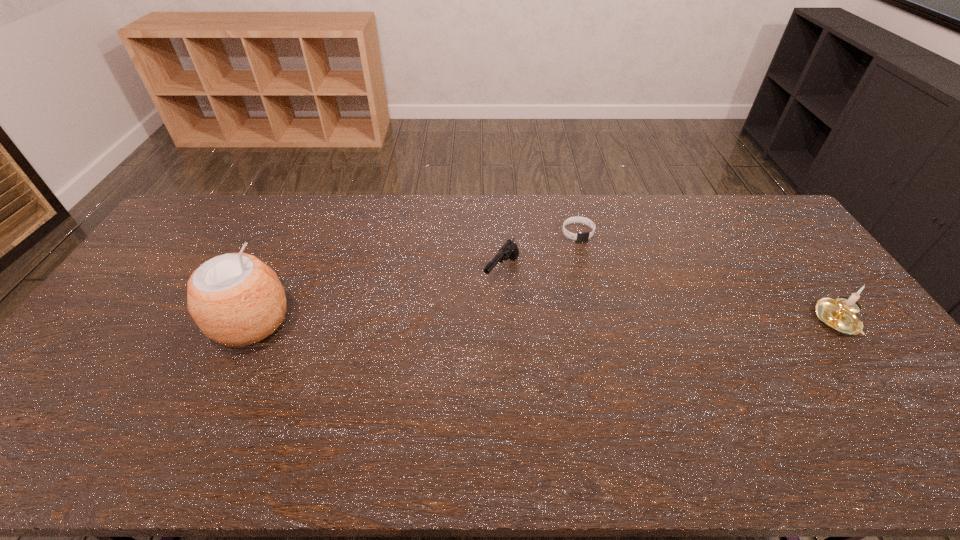
The image size is (960, 540). In order to click on vacant region located on the outer surface of the second object from right to left in this screenshot , I will do [x=615, y=308].

You are a GUI agent. You are given a task and a screenshot of the screen. Output one action in this format:
    pyautogui.click(x=<x>, y=<y>)
    Task: Click on the vacant space located 0.340m on the outer surface of the second object from right to left
    
    Given the screenshot: What is the action you would take?
    pyautogui.click(x=620, y=319)

You are a GUI agent. You are given a task and a screenshot of the screen. Output one action in this format:
    pyautogui.click(x=<x>, y=<y>)
    Task: Click on the vacant position located on the outer surface of the second object from right to left
    The height and width of the screenshot is (540, 960).
    Given the screenshot: What is the action you would take?
    pyautogui.click(x=592, y=262)

Where is `vacant space positioned at the end of the barrel of the second object from left to right`? The height and width of the screenshot is (540, 960). vacant space positioned at the end of the barrel of the second object from left to right is located at coordinates (468, 320).

The height and width of the screenshot is (540, 960). Identify the location of vacant space positioned at the end of the barrel of the second object from left to right. (465, 325).

Locate an element on the screen. This screenshot has height=540, width=960. free spot located 0.380m at the end of the barrel of the second object from left to right is located at coordinates (418, 383).

Locate an element on the screen. Image resolution: width=960 pixels, height=540 pixels. object located in the far edge section of the desktop is located at coordinates (580, 236).

The image size is (960, 540). I want to click on object that is at the right edge, so click(x=839, y=315).

Find the location of a particular element. The width and height of the screenshot is (960, 540). free spot at the far edge of the desktop is located at coordinates (342, 234).

Locate an element on the screen. blank space at the near edge is located at coordinates (332, 394).